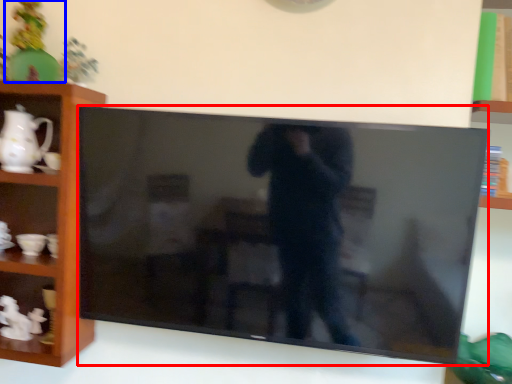
Question: Which object is closer to the camera taking this photo, television (highlighted by a red box) or toy (highlighted by a blue box)?

Choices:
 (A) television
 (B) toy

Answer: (A)